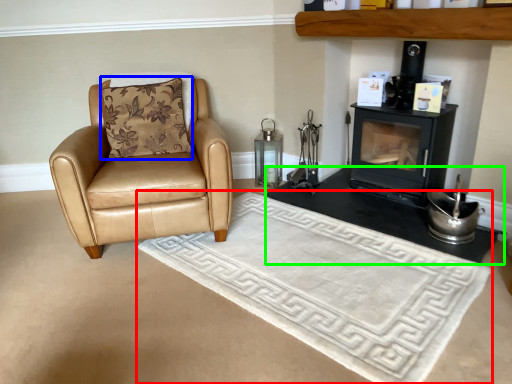
Question: Based on their relative distances, which object is nearer to mat (highlighted by a red box)? Choose from pillow (highlighted by a blue box) and table (highlighted by a green box).

Choices:
 (A) pillow
 (B) table

Answer: (B)